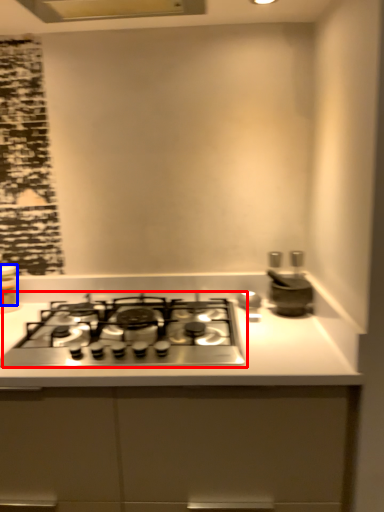
Question: Which point is further to the camera, gas stove (highlighted by a red box) or kitchen appliance (highlighted by a blue box)?

Choices:
 (A) gas stove
 (B) kitchen appliance

Answer: (B)